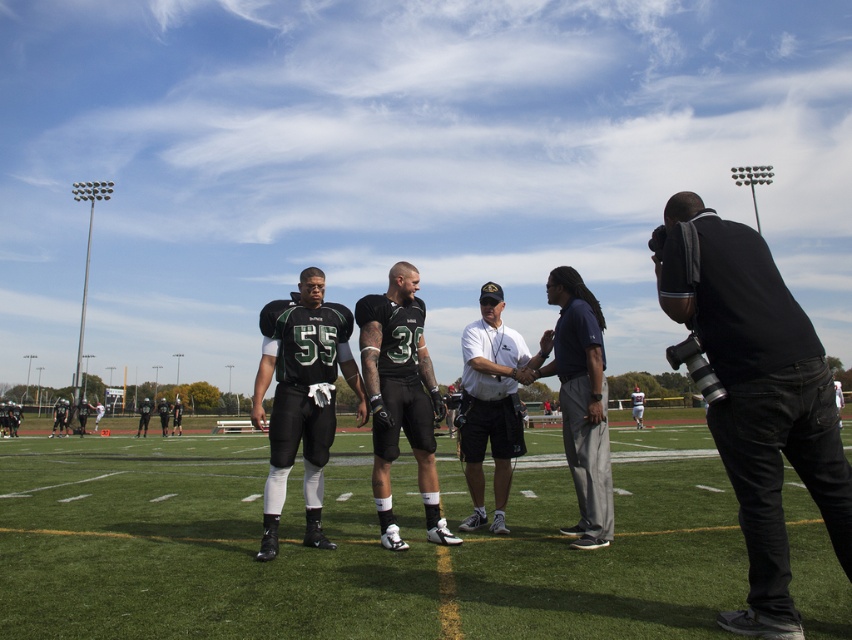
You are a photographer trying to position a tripod to capture the two players in the foreground and the coaching staff to the right. The black fabric camera at right is already placed at a specific coordinate. Can you determine if the camera is positioned to the right of the two players?

The black fabric camera at right is located at point (758, 397), which is to the right of the two players in the foreground. Therefore, the camera is positioned to the right of the players.

You are a photographer positioned at the edge of the football field. You need to take a photo that includes both the black matte uniform at center and the white shirt at center. Based on their positions, which direction should you move to ensure both are in frame?

The black matte uniform at center is to the left of the white shirt at center. To include both in your photo, you should position yourself so that you can capture the area between their left and right positions, ensuring both are within the frame.

You are a photographer trying to capture a clear photo of the black matte football uniforms at center and the black matte uniform at center. Which one should you focus on to ensure it takes up more space in your photo?

The black matte uniform at center should be focused on because it occupies more space than the black matte football uniforms at center.